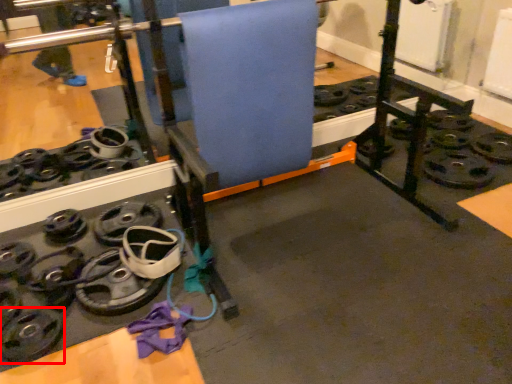
Question: In this image, where is wheel (annotated by the red box) located relative to yoga mat?

Choices:
 (A) right
 (B) left

Answer: (B)